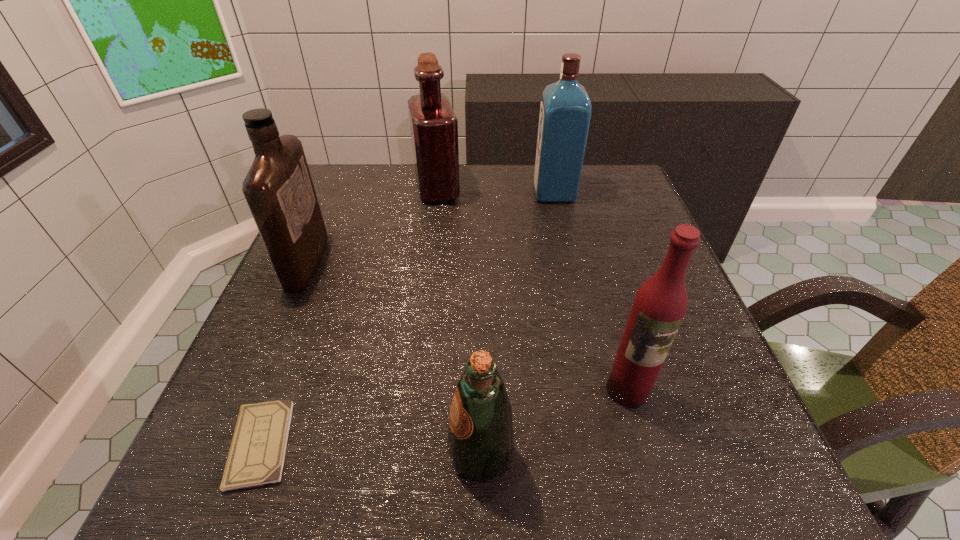
Find the location of a particular element. This screenshot has width=960, height=540. the second liquor from left to right is located at coordinates (434, 127).

Find the location of a particular element. The image size is (960, 540). the leftmost liquor is located at coordinates (278, 188).

Locate an element on the screen. the third farthest object is located at coordinates (278, 188).

Where is `the nearest liquor`? This screenshot has height=540, width=960. the nearest liquor is located at coordinates (660, 304).

Find the location of `the fourth object from left to right`. the fourth object from left to right is located at coordinates (480, 439).

The image size is (960, 540). Identify the location of the fifth tallest object. (480, 439).

Locate an element on the screen. This screenshot has width=960, height=540. the shortest object is located at coordinates (257, 453).

At what (x,y) coordinates should I click in order to perform the action: click on free region located 0.320m on the right of the second liquor from left to right. Please return your answer as a coordinate pair (x, y). Looking at the image, I should click on (580, 188).

The width and height of the screenshot is (960, 540). I want to click on vacant position located on the label side of the second nearest liquor, so click(x=448, y=261).

The image size is (960, 540). I want to click on free space located on the front-facing side of the olive oil, so click(219, 454).